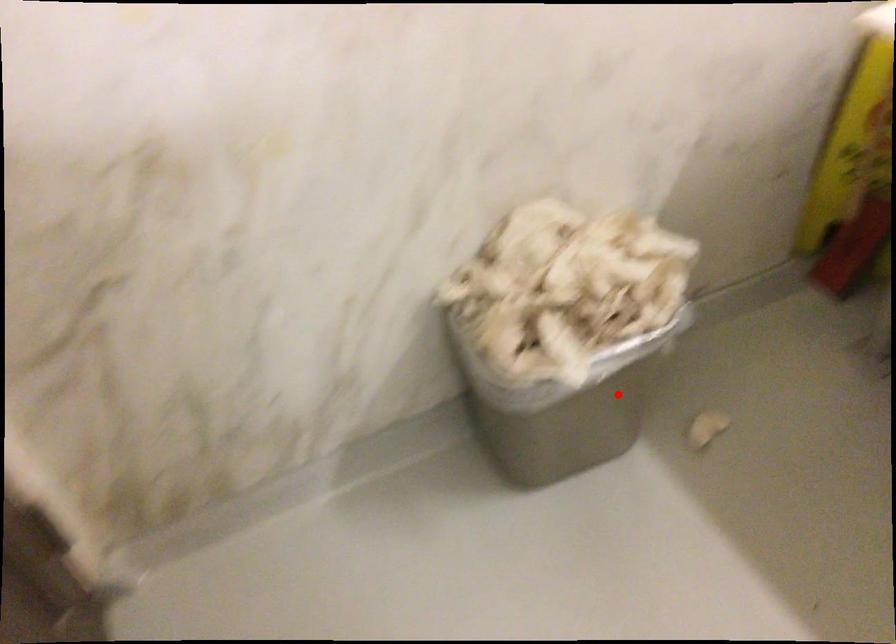
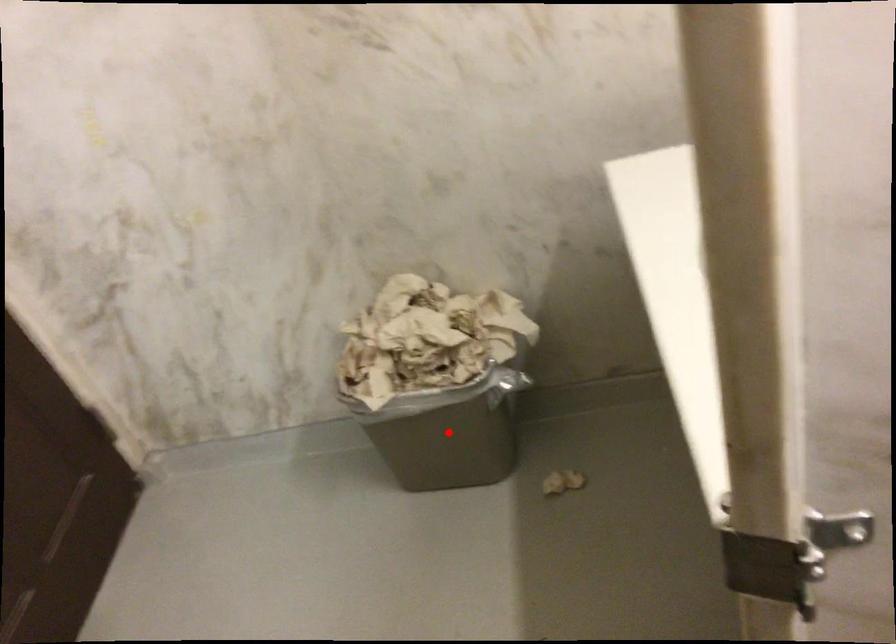
I am providing you with two images of the same scene from different viewpoints. A red point is marked on the first image and another point is marked on the second image. Does the point marked in image1 correspond to the same location as the one in image2?

Yes